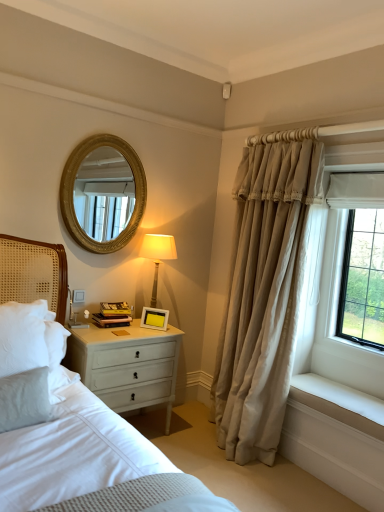
Question: From the image's perspective, is white matte picture frame at upper right positioned above or below white smooth window sill at lower right?

Choices:
 (A) above
 (B) below

Answer: (A)

Question: Is white matte picture frame at upper right inside the boundaries of white smooth window sill at lower right, or outside?

Choices:
 (A) outside
 (B) inside

Answer: (A)

Question: Which object is the closest to the beige fabric curtain at right?

Choices:
 (A) hardcover books at bedside
 (B) white painted wood nightstand at lower left
 (C) white matte picture frame at upper right
 (D) gold textured mirror at upper center
 (E) matte beige lampshade at upper right

Answer: (B)

Question: Which object is the closest to the matte beige lampshade at upper right?

Choices:
 (A) beige fabric curtain at right
 (B) white matte picture frame at upper right
 (C) white painted wood nightstand at lower left
 (D) white smooth window sill at lower right
 (E) gold textured mirror at upper center

Answer: (B)